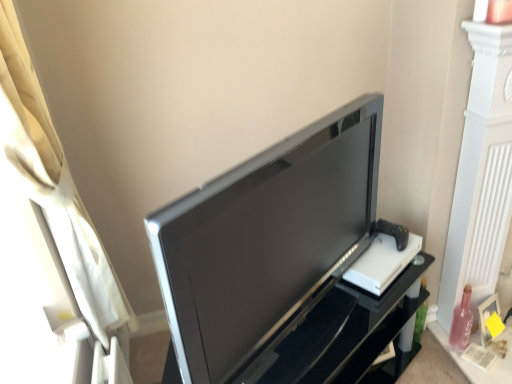
Question: From the image's perspective, is satin black tv at center located above pink glass bottle at lower right?

Choices:
 (A) yes
 (B) no

Answer: (B)

Question: Does satin black tv at center appear on the left side of pink glass bottle at lower right?

Choices:
 (A) no
 (B) yes

Answer: (B)

Question: Is satin black tv at center wider than pink glass bottle at lower right?

Choices:
 (A) yes
 (B) no

Answer: (A)

Question: Does satin black tv at center have a greater height compared to pink glass bottle at lower right?

Choices:
 (A) yes
 (B) no

Answer: (A)

Question: Is satin black tv at center aimed at pink glass bottle at lower right?

Choices:
 (A) yes
 (B) no

Answer: (B)

Question: Is satin black tv at center at the right side of pink glass bottle at lower right?

Choices:
 (A) no
 (B) yes

Answer: (A)

Question: Is satin black television at center at the back of satin black tv at center?

Choices:
 (A) no
 (B) yes

Answer: (A)

Question: Considering the relative sizes of satin black tv at center and satin black television at center in the image provided, is satin black tv at center wider than satin black television at center?

Choices:
 (A) yes
 (B) no

Answer: (A)

Question: From a real-world perspective, is satin black tv at center positioned under satin black television at center based on gravity?

Choices:
 (A) no
 (B) yes

Answer: (B)

Question: Is satin black tv at center bigger than satin black television at center?

Choices:
 (A) no
 (B) yes

Answer: (B)

Question: Can you confirm if satin black tv at center is thinner than satin black television at center?

Choices:
 (A) yes
 (B) no

Answer: (B)

Question: Does satin black tv at center turn towards satin black television at center?

Choices:
 (A) no
 (B) yes

Answer: (A)

Question: Is pink glass bottle at lower right far from satin black television at center?

Choices:
 (A) no
 (B) yes

Answer: (A)